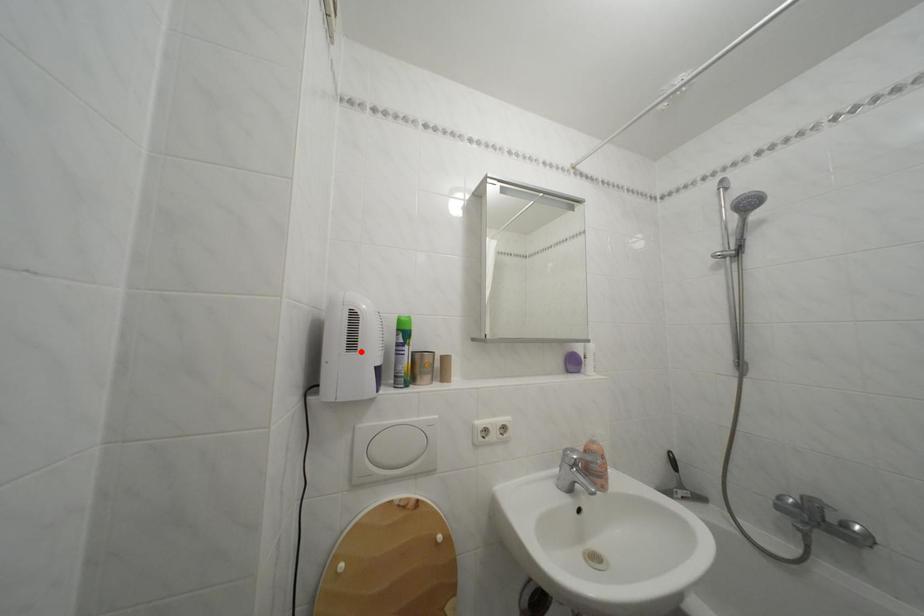
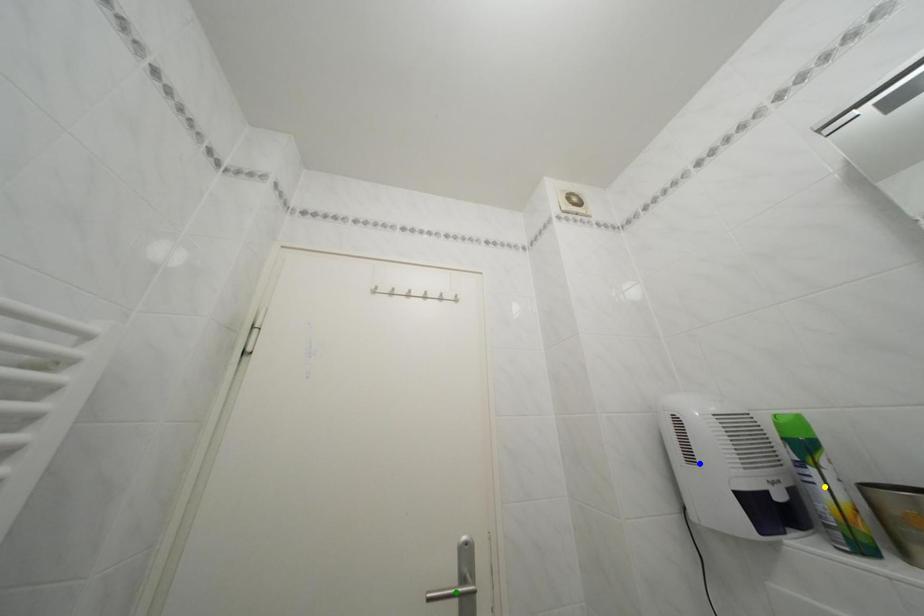
Question: I am providing you with two images of the same scene from different viewpoints. A red point is marked on the first image. You are given multiple points on the second image. Which point in image 2 represents the same 3d spot as the red point in image 1?

Choices:
 (A) blue point
 (B) green point
 (C) yellow point

Answer: (A)